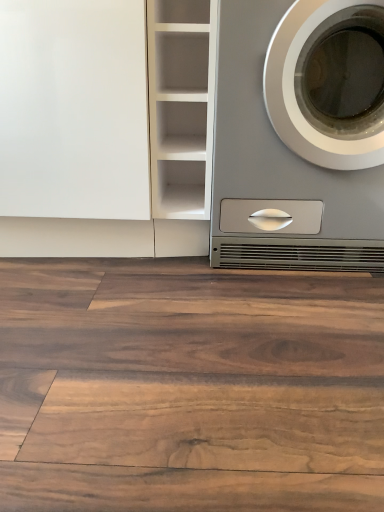
Question: Is the position of white glossy cabinet at upper left more distant than that of white matte cabinet at center?

Choices:
 (A) yes
 (B) no

Answer: (A)

Question: From a real-world perspective, is white glossy cabinet at upper left physically above white matte cabinet at center?

Choices:
 (A) no
 (B) yes

Answer: (A)

Question: Can you confirm if white glossy cabinet at upper left is positioned to the left of white matte cabinet at center?

Choices:
 (A) no
 (B) yes

Answer: (B)

Question: Is white matte cabinet at center a part of white glossy cabinet at upper left?

Choices:
 (A) yes
 (B) no

Answer: (B)

Question: Is white glossy cabinet at upper left placed right next to white matte cabinet at center?

Choices:
 (A) no
 (B) yes

Answer: (A)

Question: Considering the relative positions of brown wood flooring at center and white glossy cabinet at upper left in the image provided, is brown wood flooring at center to the left or to the right of white glossy cabinet at upper left?

Choices:
 (A) left
 (B) right

Answer: (B)

Question: Is brown wood flooring at center in front of or behind white glossy cabinet at upper left in the image?

Choices:
 (A) behind
 (B) front

Answer: (B)

Question: Would you say brown wood flooring at center is inside or outside white glossy cabinet at upper left?

Choices:
 (A) outside
 (B) inside

Answer: (A)

Question: Considering the positions of brown wood flooring at center and white glossy cabinet at upper left in the image, is brown wood flooring at center wider or thinner than white glossy cabinet at upper left?

Choices:
 (A) thin
 (B) wide

Answer: (B)

Question: In terms of height, does white glossy cabinet at upper left look taller or shorter compared to satin silver washing machine at right?

Choices:
 (A) short
 (B) tall

Answer: (B)

Question: From a real-world perspective, relative to satin silver washing machine at right, is white glossy cabinet at upper left vertically above or below?

Choices:
 (A) below
 (B) above

Answer: (A)

Question: In the image, is white glossy cabinet at upper left positioned in front of or behind satin silver washing machine at right?

Choices:
 (A) front
 (B) behind

Answer: (B)

Question: Is white glossy cabinet at upper left bigger or smaller than satin silver washing machine at right?

Choices:
 (A) small
 (B) big

Answer: (A)

Question: Is white matte cabinet at center wider or thinner than brown wood flooring at center?

Choices:
 (A) thin
 (B) wide

Answer: (A)

Question: Does point (203, 148) appear closer or farther from the camera than point (256, 437)?

Choices:
 (A) farther
 (B) closer

Answer: (A)